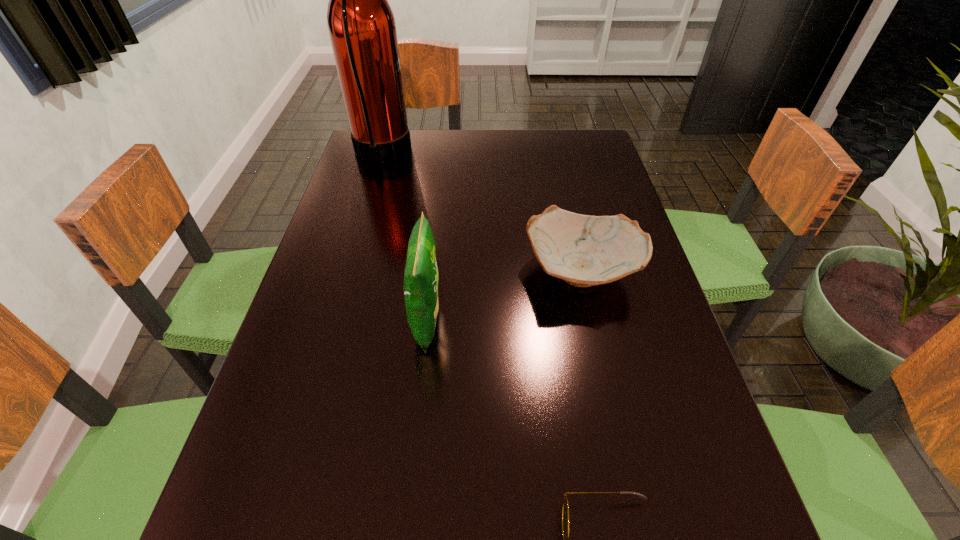
What are the coordinates of `object at the right edge` in the screenshot? It's located at (584, 250).

Find the location of a particular element. The image size is (960, 540). object that is positioned at the far left corner is located at coordinates point(361,24).

In the image, there is a desktop. Identify the location of free region at the far edge. Image resolution: width=960 pixels, height=540 pixels. (512, 164).

In the image, there is a desktop. Identify the location of vacant space at the left edge. This screenshot has height=540, width=960. (357, 333).

Identify the location of free space at the right edge. The width and height of the screenshot is (960, 540). (622, 200).

At what (x,y) coordinates should I click in order to perform the action: click on free region at the far right corner of the desktop. Please return your answer as a coordinate pair (x, y). The height and width of the screenshot is (540, 960). Looking at the image, I should click on tap(560, 144).

Image resolution: width=960 pixels, height=540 pixels. Find the location of `vacant space that is in between the farthest object and the crisp (potato chip)`. vacant space that is in between the farthest object and the crisp (potato chip) is located at coordinates (404, 238).

What are the coordinates of `vacant area between the second shortest object and the leftmost object` in the screenshot? It's located at (481, 212).

Where is `free space between the fire extinguisher and the third tallest object`? Image resolution: width=960 pixels, height=540 pixels. free space between the fire extinguisher and the third tallest object is located at coordinates (481, 212).

The image size is (960, 540). I want to click on vacant space in between the leftmost object and the third tallest object, so click(x=481, y=212).